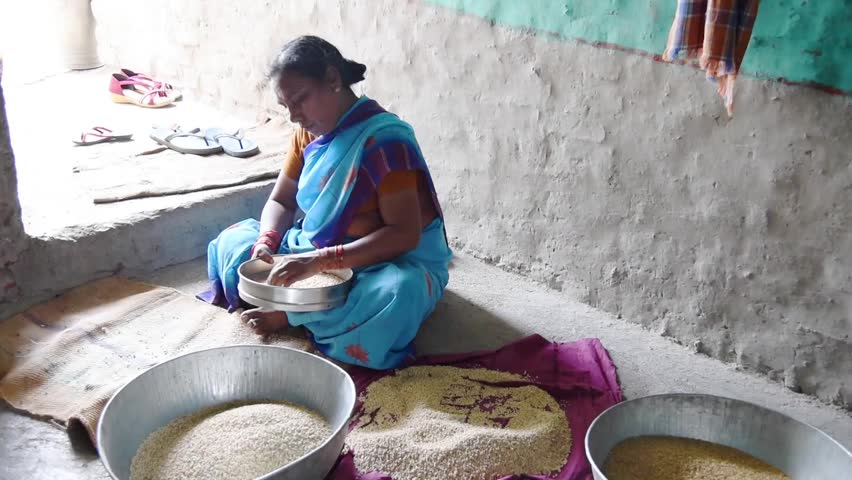
Locate an element on the screen. pink blanket is located at coordinates (584, 375).